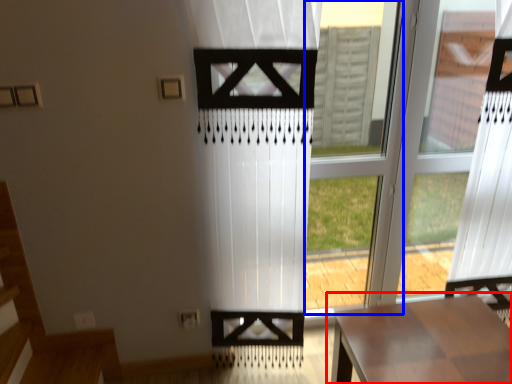
Question: Which object appears closest to the camera in this image, table (highlighted by a red box) or window frame (highlighted by a blue box)?

Choices:
 (A) table
 (B) window frame

Answer: (A)